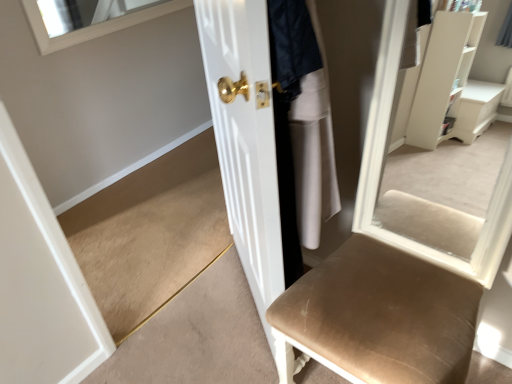
Question: Can you confirm if white fabric skirt at center is taller than white glossy door at center?

Choices:
 (A) no
 (B) yes

Answer: (A)

Question: Is white fabric skirt at center not inside white glossy door at center?

Choices:
 (A) yes
 (B) no

Answer: (A)

Question: From the image's perspective, is white fabric skirt at center over white glossy door at center?

Choices:
 (A) no
 (B) yes

Answer: (B)

Question: Considering the relative positions of white fabric skirt at center and white glossy door at center in the image provided, is white fabric skirt at center in front of white glossy door at center?

Choices:
 (A) no
 (B) yes

Answer: (A)

Question: Is white fabric skirt at center wider than white glossy door at center?

Choices:
 (A) no
 (B) yes

Answer: (B)

Question: From a real-world perspective, does white fabric skirt at center stand above white glossy door at center?

Choices:
 (A) no
 (B) yes

Answer: (B)

Question: Is white fabric skirt at center inside white glossy door at center?

Choices:
 (A) yes
 (B) no

Answer: (B)

Question: From the image's perspective, is white glossy door at center on white fabric skirt at center?

Choices:
 (A) no
 (B) yes

Answer: (A)

Question: Considering the relative sizes of white glossy door at center and white fabric skirt at center in the image provided, is white glossy door at center taller than white fabric skirt at center?

Choices:
 (A) yes
 (B) no

Answer: (A)

Question: Are white glossy door at center and white fabric skirt at center beside each other?

Choices:
 (A) no
 (B) yes

Answer: (A)

Question: Considering the relative sizes of white glossy door at center and white fabric skirt at center in the image provided, is white glossy door at center thinner than white fabric skirt at center?

Choices:
 (A) no
 (B) yes

Answer: (B)

Question: Considering the relative sizes of white glossy door at center and white fabric skirt at center in the image provided, is white glossy door at center smaller than white fabric skirt at center?

Choices:
 (A) no
 (B) yes

Answer: (A)

Question: Do you think white glossy door at center is within white fabric skirt at center, or outside of it?

Choices:
 (A) inside
 (B) outside

Answer: (B)